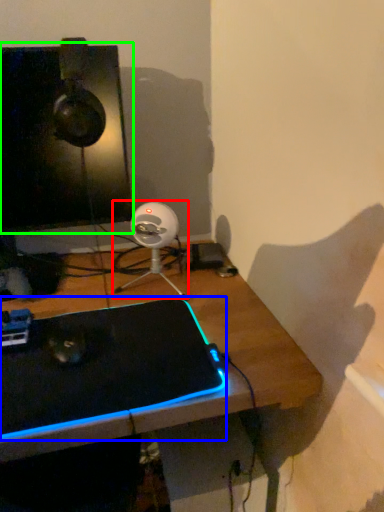
Question: Estimate the real-world distances between objects in this image. Which object is farther from fan (highlighted by a red box), laptop (highlighted by a blue box) or computer monitor (highlighted by a green box)?

Choices:
 (A) laptop
 (B) computer monitor

Answer: (A)